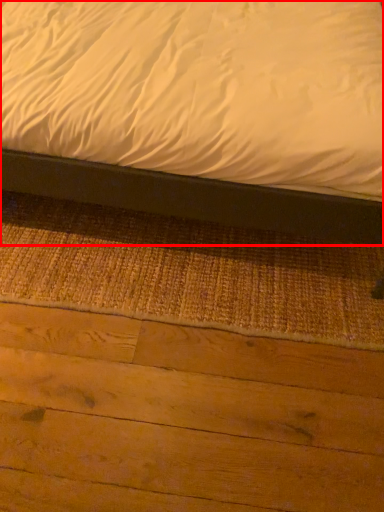
Question: From the image, what is the correct spatial relationship of bed (annotated by the red box) in relation to plywood?

Choices:
 (A) left
 (B) right

Answer: (A)